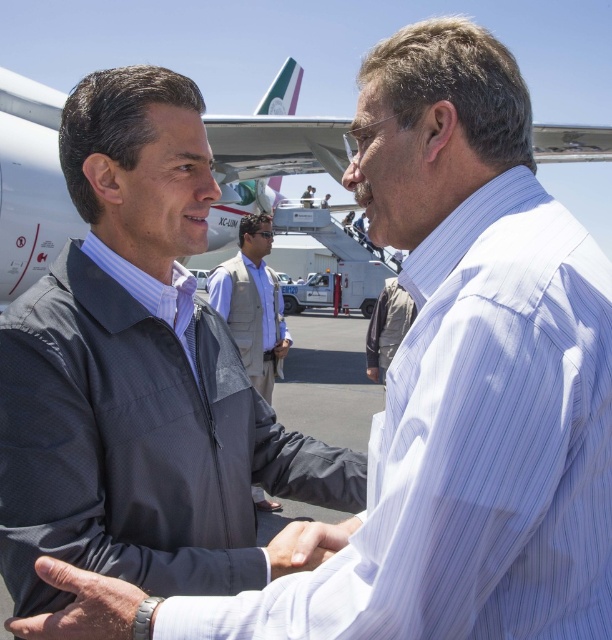
Describe the element at coordinates (140, 444) in the screenshot. I see `dark gray textured jacket at center` at that location.

Is dark gray textured jacket at center wider than smooth skin hand at center?

Indeed, dark gray textured jacket at center has a greater width compared to smooth skin hand at center.

Locate an element on the screen. The image size is (612, 640). dark gray textured jacket at center is located at coordinates (140, 444).

Identify the location of dark gray textured jacket at center. This screenshot has height=640, width=612. (140, 444).

Can you confirm if dark gray textured jacket at center is wider than light brown vest at center?

Yes.

Can you confirm if dark gray textured jacket at center is thinner than light brown vest at center?

In fact, dark gray textured jacket at center might be wider than light brown vest at center.

Is point (17, 611) closer to camera compared to point (267, 346)?

Yes, it is.

At what (x,y) coordinates should I click in order to perform the action: click on dark gray textured jacket at center. Please return your answer as a coordinate pair (x, y). Image resolution: width=612 pixels, height=640 pixels. Looking at the image, I should click on (140, 444).

Looking at this image, can you confirm if dark gray textured jacket at center is positioned to the left of white metallic airplane at upper center?

Correct, you'll find dark gray textured jacket at center to the left of white metallic airplane at upper center.

Who is taller, dark gray textured jacket at center or white metallic airplane at upper center?

Standing taller between the two is white metallic airplane at upper center.

In order to click on dark gray textured jacket at center in this screenshot , I will do tap(140, 444).